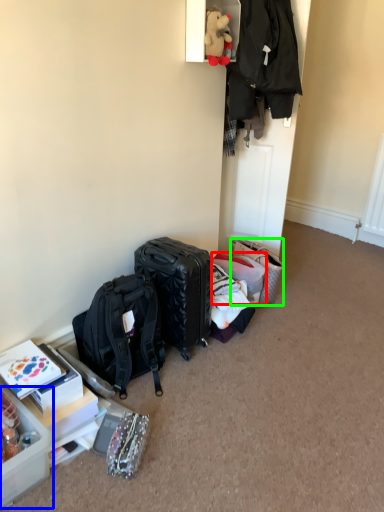
Question: Based on their relative distances, which object is farther from suitcase (highlighted by a red box)? Choose from box (highlighted by a blue box) and handbag (highlighted by a green box).

Choices:
 (A) box
 (B) handbag

Answer: (A)